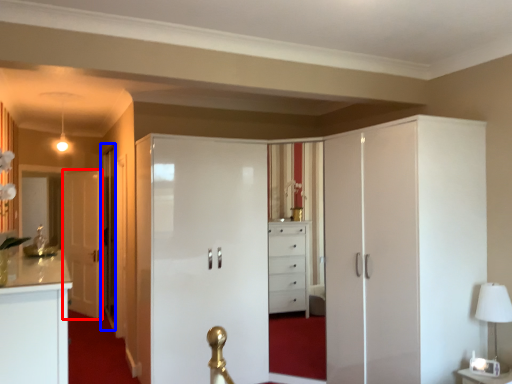
Question: Which of the following is the farthest to the observer, door (highlighted by a red box) or glass door (highlighted by a blue box)?

Choices:
 (A) door
 (B) glass door

Answer: (A)